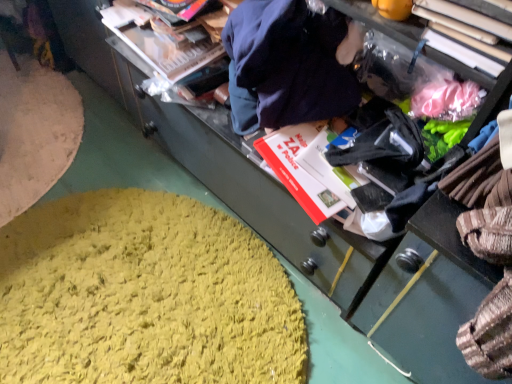
What do you see at coordinates (144, 295) in the screenshot?
I see `yellow shaggy rug at lower left` at bounding box center [144, 295].

Find the location of a particular element. Image resolution: width=512 pixels, height=384 pixels. yellow shaggy rug at lower left is located at coordinates (144, 295).

Where is `yellow shaggy rug at lower left`? This screenshot has height=384, width=512. yellow shaggy rug at lower left is located at coordinates (144, 295).